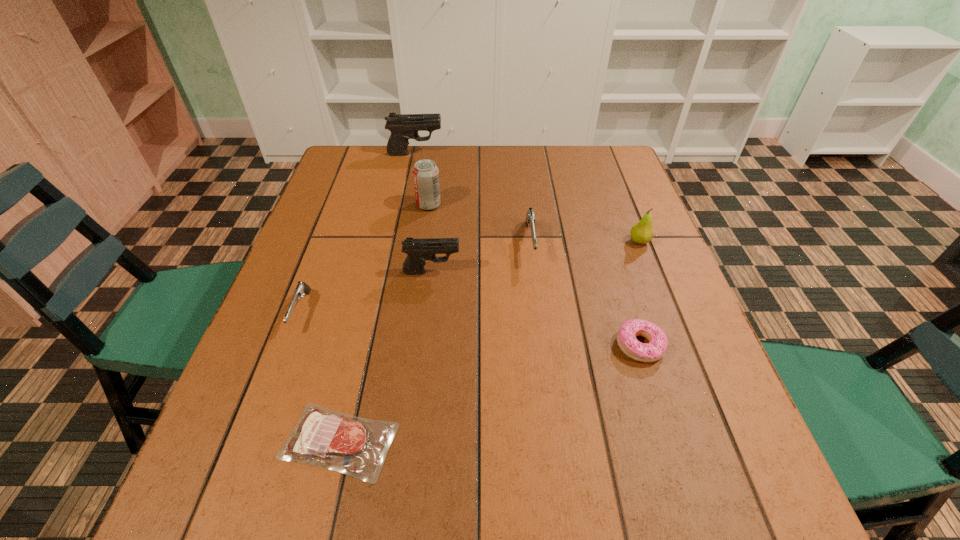
Identify the location of the bigger black pistol. The image size is (960, 540). (403, 127).

Locate an element on the screen. the tallest pistol is located at coordinates (403, 127).

What are the coordinates of `gray soda can` in the screenshot? It's located at (425, 173).

Locate an element on the screen. The width and height of the screenshot is (960, 540). soda can is located at coordinates (425, 173).

Where is `the rightmost object`? This screenshot has height=540, width=960. the rightmost object is located at coordinates (642, 232).

At what (x,y) coordinates should I click in order to perform the action: click on the nearer black pistol. Please return your answer as a coordinate pair (x, y). Image resolution: width=960 pixels, height=540 pixels. Looking at the image, I should click on click(418, 251).

This screenshot has height=540, width=960. I want to click on the smaller black pistol, so click(x=418, y=251).

You are a GUI agent. You are given a task and a screenshot of the screen. Output one action in this format:
    pyautogui.click(x=<x>, y=<y>)
    Task: Click on the sixth object from left to right
    Image resolution: width=960 pixels, height=540 pixels.
    Given the screenshot: What is the action you would take?
    coord(530,216)

The image size is (960, 540). In order to click on the right silver pistol in this screenshot , I will do 530,216.

This screenshot has width=960, height=540. I want to click on the leftmost pistol, so click(301, 288).